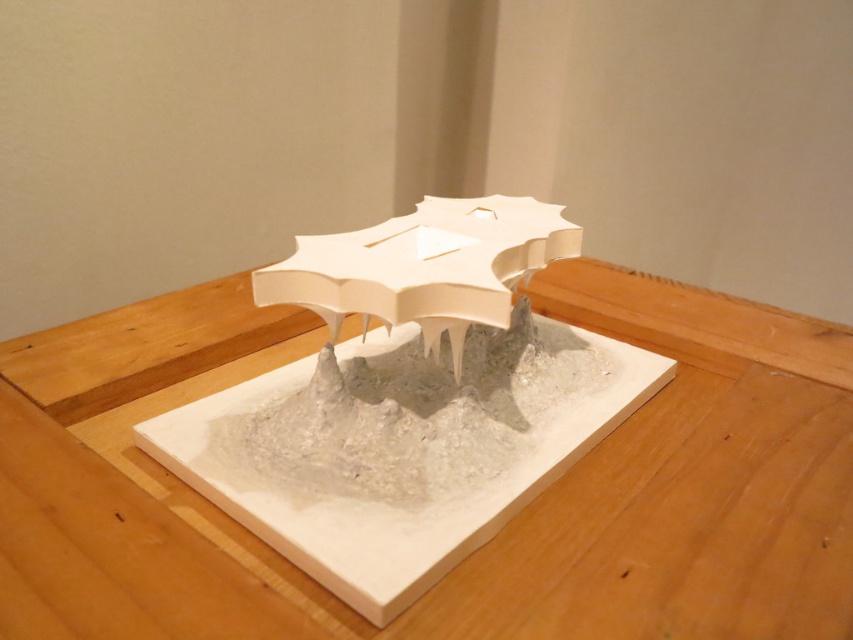
Question: Among these points, which one is nearest to the camera?

Choices:
 (A) (474, 204)
 (B) (61, 412)

Answer: (B)

Question: Does white matte table at center appear over matte white umbrella at center?

Choices:
 (A) yes
 (B) no

Answer: (B)

Question: Does white matte table at center appear over matte white umbrella at center?

Choices:
 (A) yes
 (B) no

Answer: (B)

Question: Which object is farther from the camera taking this photo?

Choices:
 (A) white matte table at center
 (B) matte white umbrella at center

Answer: (B)

Question: Is white matte table at center thinner than matte white umbrella at center?

Choices:
 (A) yes
 (B) no

Answer: (B)